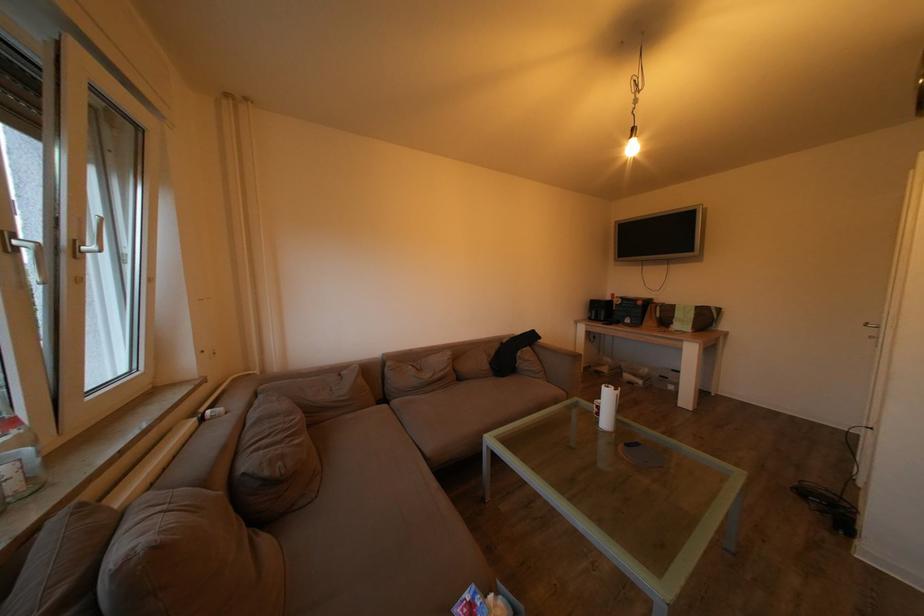
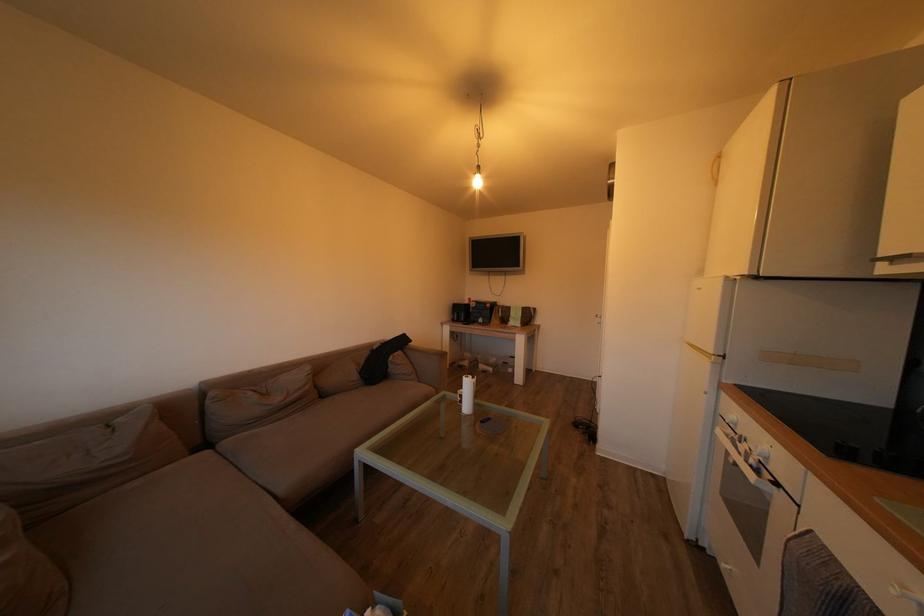
In the second image, find the point that corresponds to point 548,344 in the first image.

(419, 347)